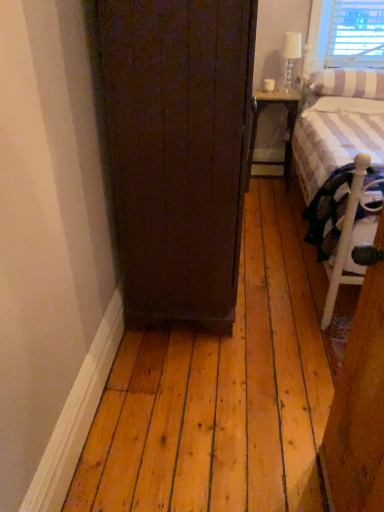
Question: In terms of width, does striped fabric pillow at upper right look wider or thinner when compared to metallic gray nightstand at right?

Choices:
 (A) thin
 (B) wide

Answer: (B)

Question: Is striped fabric pillow at upper right situated inside metallic gray nightstand at right or outside?

Choices:
 (A) inside
 (B) outside

Answer: (B)

Question: Considering the real-world distances, which object is closest to the dark wood door at center?

Choices:
 (A) white glass lamp at upper right
 (B) metallic gray nightstand at right
 (C) striped fabric pillow at upper right
 (D) white striped fabric at right

Answer: (D)

Question: Considering the real-world distances, which object is closest to the metallic gray nightstand at right?

Choices:
 (A) dark wood door at center
 (B) striped fabric pillow at upper right
 (C) white glass lamp at upper right
 (D) white striped fabric at right

Answer: (C)